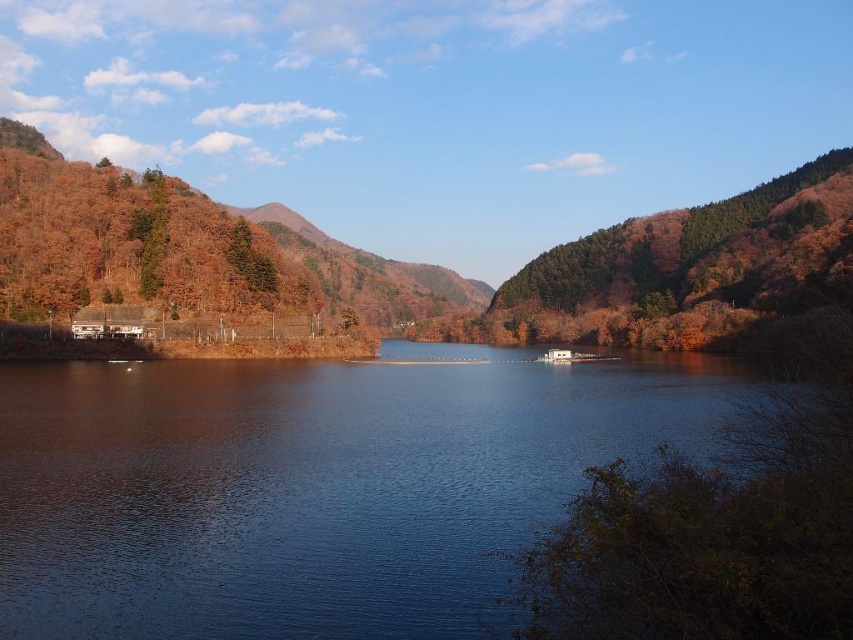
Question: Can you confirm if brown textured hillside at left is positioned above green matte tree at upper left?

Choices:
 (A) no
 (B) yes

Answer: (B)

Question: Which is nearer to the green matte tree at upper left?

Choices:
 (A) brown textured hillside at left
 (B) blue water at center

Answer: (B)

Question: Which of the following is the farthest from the observer?

Choices:
 (A) (149, 282)
 (B) (83, 442)

Answer: (A)

Question: Estimate the real-world distances between objects in this image. Which object is farther from the blue water at center?

Choices:
 (A) brown textured hillside at left
 (B) green matte tree at upper left

Answer: (A)

Question: Can you confirm if blue water at center is thinner than brown textured hillside at left?

Choices:
 (A) yes
 (B) no

Answer: (A)

Question: Is brown textured hillside at left positioned at the back of green matte tree at upper left?

Choices:
 (A) no
 (B) yes

Answer: (A)